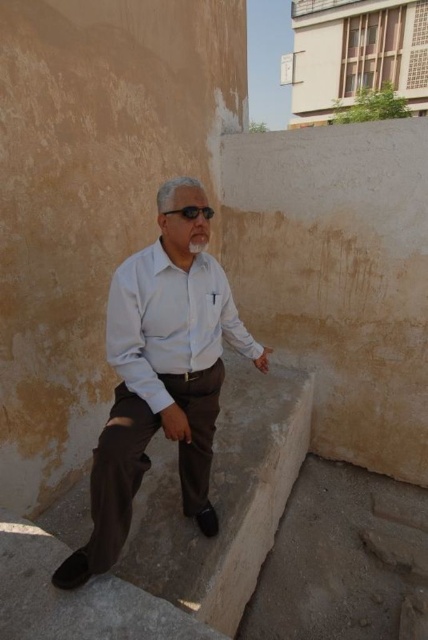
You are a photographer trying to capture the man in the light blue shirt at center and the light blue cotton shirt at center. Which one is positioned more to the right side of the image?

The light blue cotton shirt at center is positioned more to the right side of the image because the light blue shirt at center is to the left of it.

You are a photographer trying to capture the man in the image. You want to focus on the light blue shirt at center and the black matte sunglasses at center. Which object should you adjust your camera focus on first if you want both to be in sharp focus?

The light blue shirt at center is in front of the black matte sunglasses at center, so you should focus on the black matte sunglasses at center first to ensure both are in sharp focus.

You are a fashion designer observing a man in an alleyway. You notice the light blue shirt at center and the black matte sunglasses at center. Which item has a greater width?

The light blue shirt at center has a greater width than the black matte sunglasses at center.